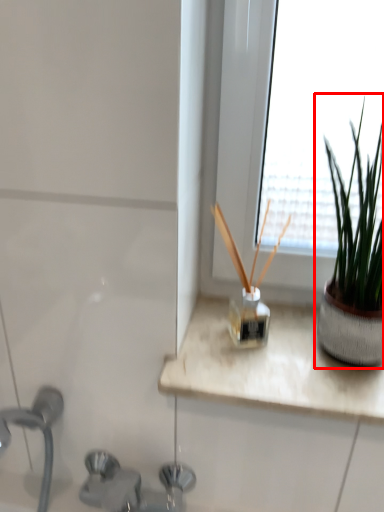
Question: From the image's perspective, where is houseplant (annotated by the red box) located in relation to sink in the image?

Choices:
 (A) above
 (B) below

Answer: (A)